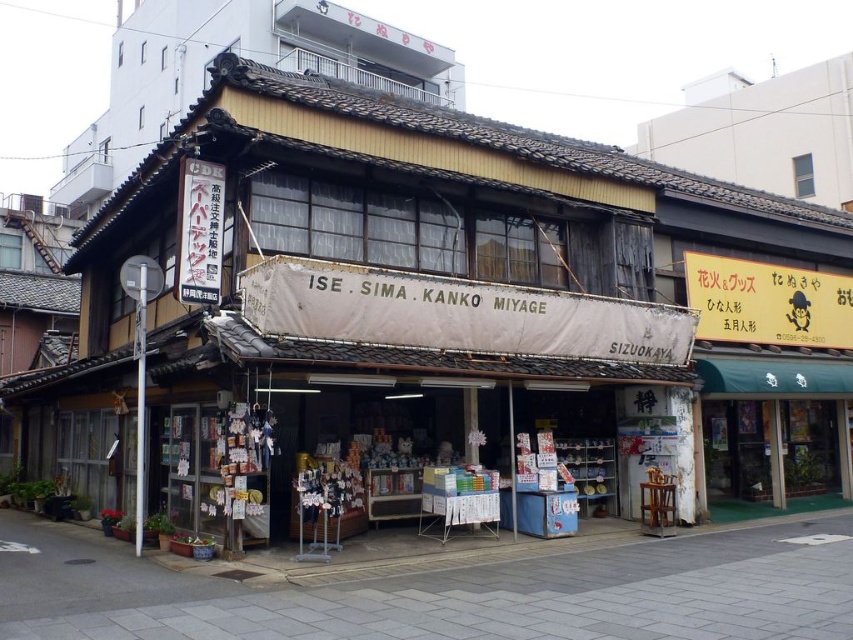
Can you confirm if yellow paper sign at upper right is positioned to the left of black paper sign at upper left?

No, yellow paper sign at upper right is not to the left of black paper sign at upper left.

Locate an element on the screen. This screenshot has width=853, height=640. yellow paper sign at upper right is located at coordinates (767, 301).